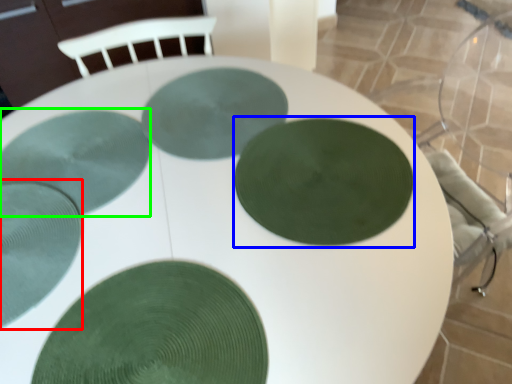
Question: Which object is positioned farthest from glass plate (highlighted by a red box)? Select from glass plate (highlighted by a blue box) and glass plate (highlighted by a green box).

Choices:
 (A) glass plate
 (B) glass plate

Answer: (A)